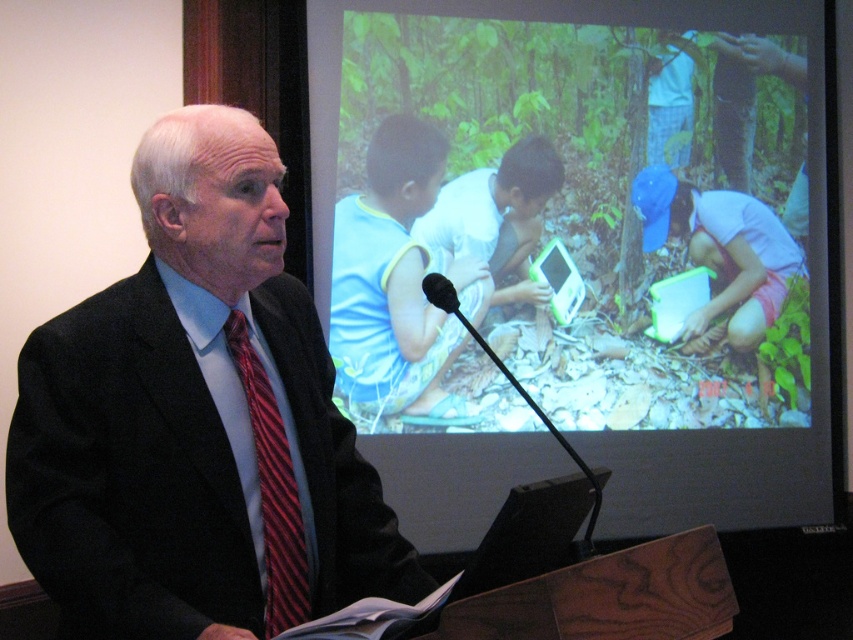
You are an event planner setting up a presentation. You need to ensure that the matte plastic screen at upper right and the striped silk tie at left are visible to the audience. Which object is taller?

The matte plastic screen at upper right is taller than the striped silk tie at left.

You are a speaker at a conference and need to adjust the focus of your projector to display a clear image on the matte plastic screen at upper right. If the projector has a minimum focus distance of 8 feet, will you be able to adjust it properly?

The matte plastic screen at upper right is 9.12 feet away from viewer, which is beyond the projector minimum focus distance of 8 feet. Therefore, the projector can be adjusted to focus properly on the matte plastic screen at upper right.